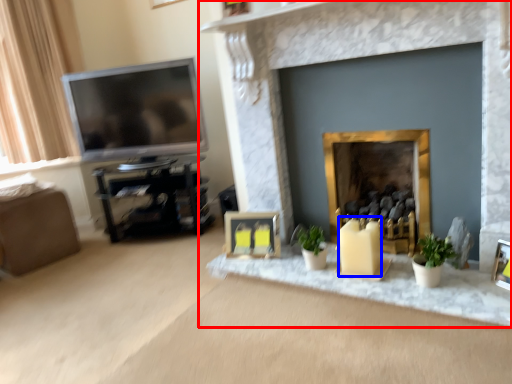
Question: Among these objects, which one is nearest to the camera, fireplace (highlighted by a red box) or candle (highlighted by a blue box)?

Choices:
 (A) fireplace
 (B) candle

Answer: (A)